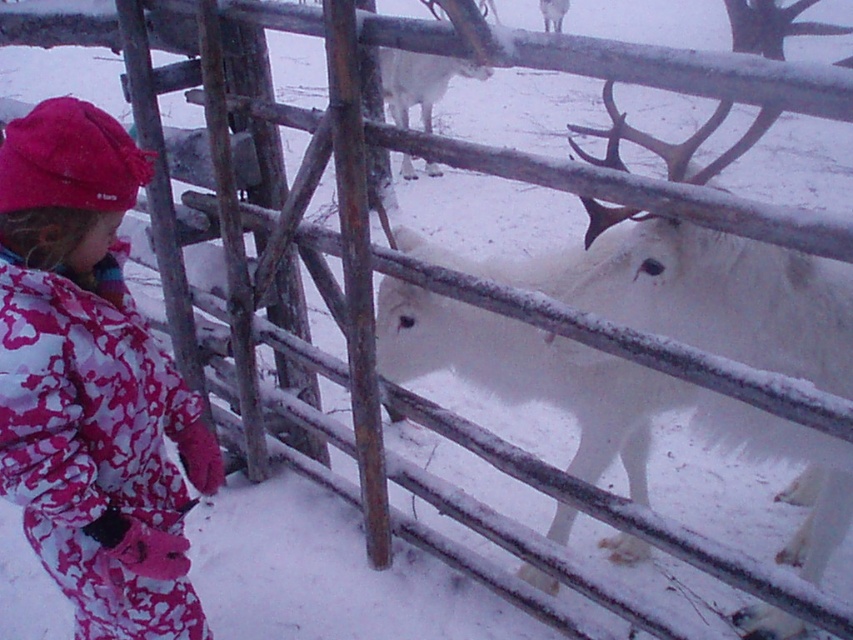
How far apart are white fluffy reindeer at center and white furry deer at right?

They are 9.53 inches apart.

Which is behind, point (447, 346) or point (664, 257)?

Point (447, 346)

You are a GUI agent. You are given a task and a screenshot of the screen. Output one action in this format:
    pyautogui.click(x=<x>, y=<y>)
    Task: Click on the white fluffy reindeer at center
    The width and height of the screenshot is (853, 640).
    Given the screenshot: What is the action you would take?
    pyautogui.click(x=529, y=372)

Who is higher up, fluffy pink snowsuit at left or white fluffy reindeer at center?

white fluffy reindeer at center is above.

Where is `fluffy pink snowsuit at left`? This screenshot has width=853, height=640. fluffy pink snowsuit at left is located at coordinates (91, 384).

Locate an element on the screen. The image size is (853, 640). fluffy pink snowsuit at left is located at coordinates (91, 384).

Does point (68, 304) lie in front of point (782, 497)?

That is True.

Where is `fluffy pink snowsuit at left`? The width and height of the screenshot is (853, 640). fluffy pink snowsuit at left is located at coordinates (91, 384).